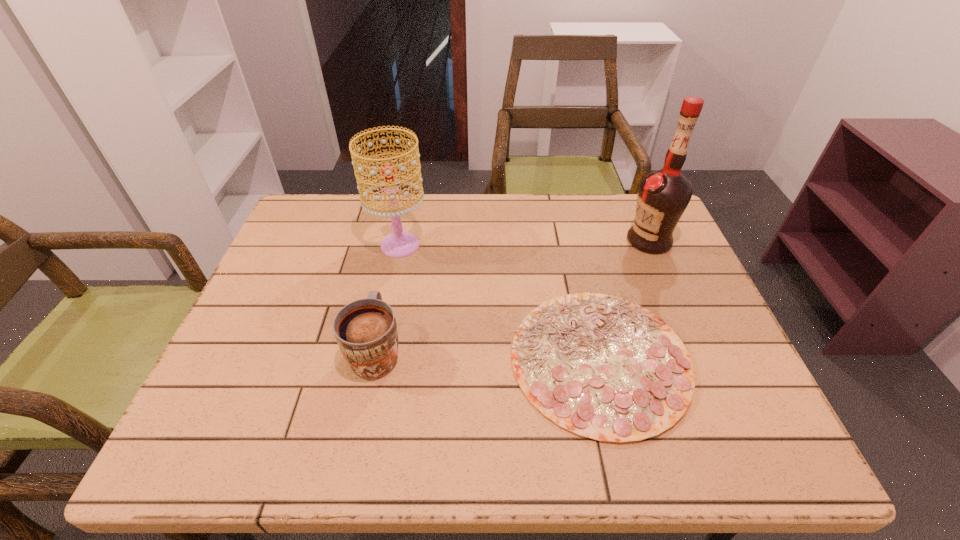
The width and height of the screenshot is (960, 540). Identify the location of free region located on the side of the mug with the handle. (390, 285).

This screenshot has width=960, height=540. I want to click on free space located 0.240m on the left of the shortest object, so click(400, 359).

The height and width of the screenshot is (540, 960). What are the coordinates of `liquor located at the far edge` in the screenshot? It's located at (663, 195).

At what (x,y) coordinates should I click in order to perform the action: click on lampshade located at the far edge. Please return your answer as a coordinate pair (x, y). The height and width of the screenshot is (540, 960). Looking at the image, I should click on (400, 243).

What are the coordinates of `object at the near edge` in the screenshot? It's located at (605, 368).

This screenshot has height=540, width=960. Find the location of `liquor that is positioned at the right edge`. liquor that is positioned at the right edge is located at coordinates (663, 195).

Identify the location of pizza that is at the right edge. (605, 368).

I want to click on object positioned at the far right corner, so click(x=663, y=195).

Identify the location of object located at the near right corner. (605, 368).

Image resolution: width=960 pixels, height=540 pixels. In order to click on vacant space at the far edge in this screenshot , I will do `click(548, 223)`.